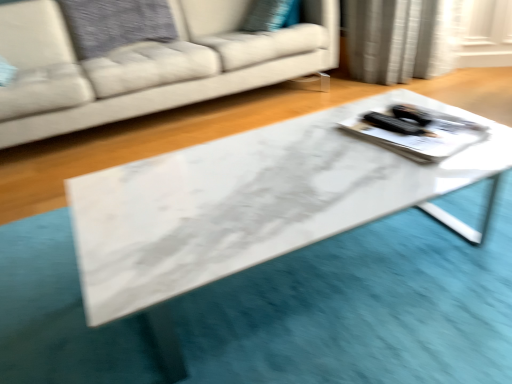
Question: Do you think white marble table at center is within white fabric couch at center, or outside of it?

Choices:
 (A) inside
 (B) outside

Answer: (B)

Question: Looking at the image, does white marble table at center seem bigger or smaller compared to white fabric couch at center?

Choices:
 (A) big
 (B) small

Answer: (B)

Question: Which object is the closest to the white marble table at center?

Choices:
 (A) white glossy tray at center
 (B) white fabric couch at center

Answer: (A)

Question: Which object is positioned farthest from the white marble table at center?

Choices:
 (A) white glossy tray at center
 (B) white fabric couch at center

Answer: (B)